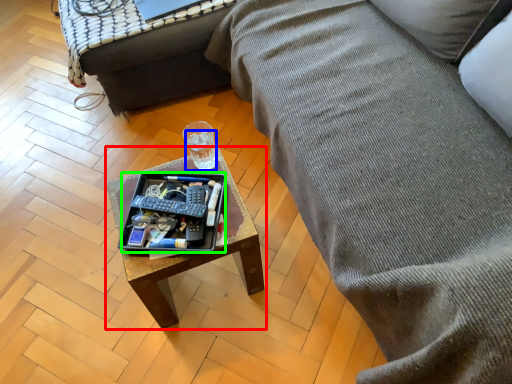
Question: Which object is positioned farthest from coffee table (highlighted by a red box)? Select from beverage (highlighted by a blue box) and tray (highlighted by a green box).

Choices:
 (A) beverage
 (B) tray

Answer: (A)